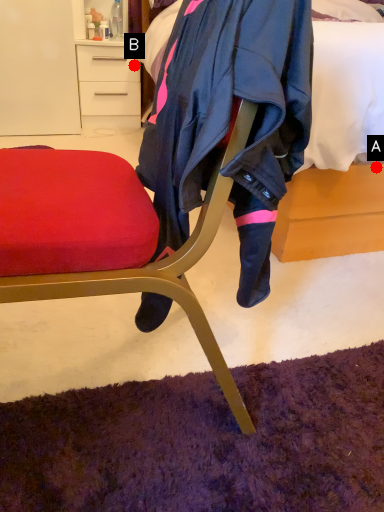
Question: Two points are circled on the image, labeled by A and B beside each circle. Which point is closer to the camera taking this photo?

Choices:
 (A) A is closer
 (B) B is closer

Answer: (A)